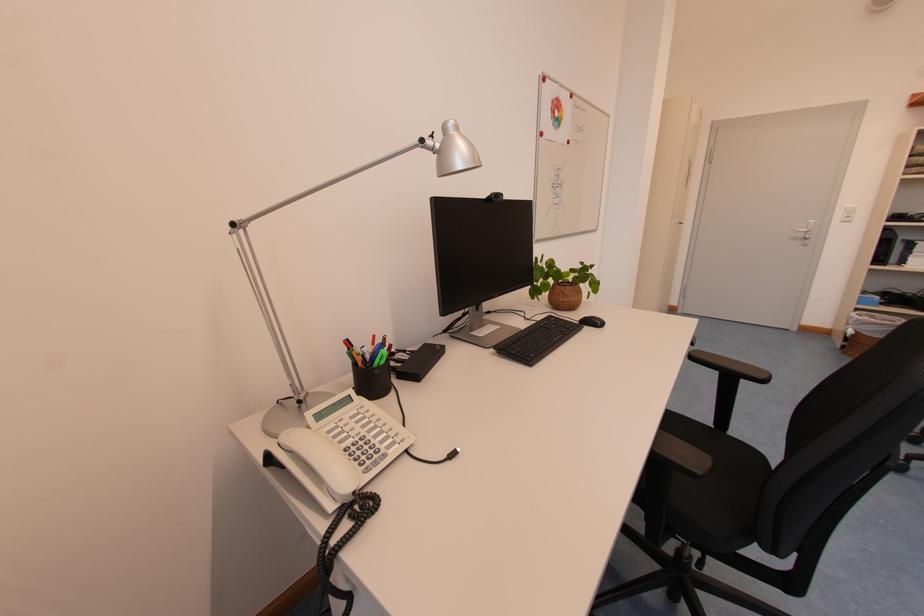
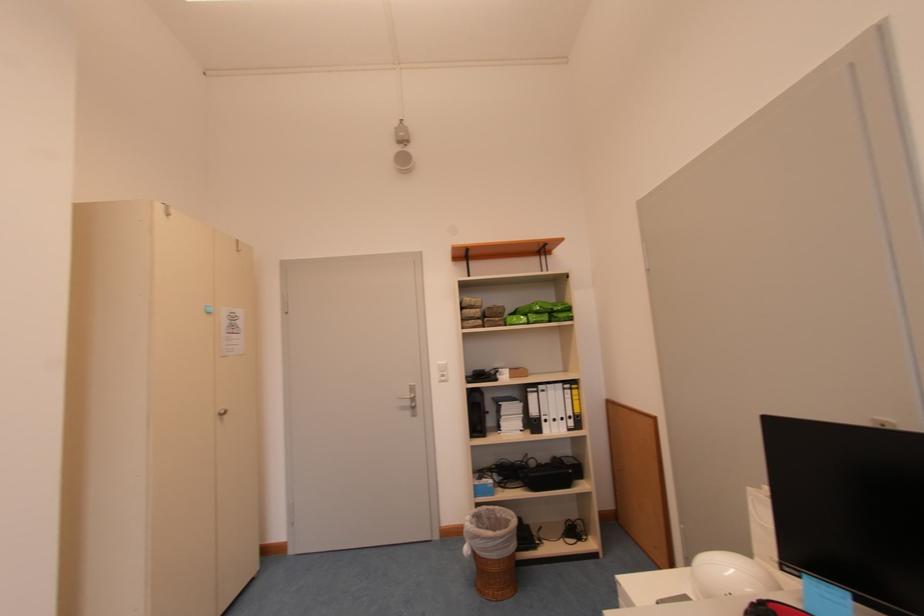
Find the pixel in the second image that matches point (883, 317) in the first image.

(504, 509)